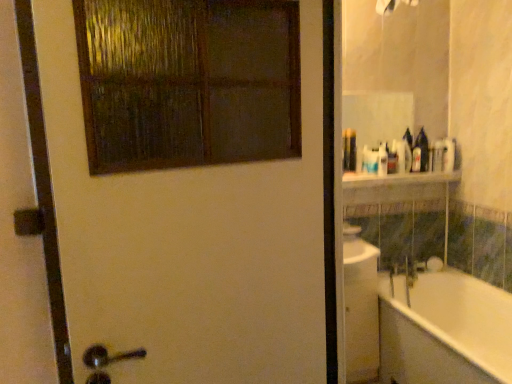
The image size is (512, 384). Identify the location of white glossy bathtub at right. (444, 330).

This screenshot has width=512, height=384. What do you see at coordinates (192, 241) in the screenshot? I see `white matte door at upper left` at bounding box center [192, 241].

Locate an element on the screen. white matte door at upper left is located at coordinates click(x=192, y=241).

The height and width of the screenshot is (384, 512). Describe the element at coordinates (392, 158) in the screenshot. I see `translucent plastic bottle at upper right` at that location.

Find the location of a particular element. This screenshot has width=512, height=384. white glossy bathtub at right is located at coordinates (444, 330).

Would you say white glossy shelf at upper center is to the left or to the right of translucent plastic bottle at upper right in the picture?

Based on their positions, white glossy shelf at upper center is located to the left of translucent plastic bottle at upper right.

In terms of height, does white glossy shelf at upper center look taller or shorter compared to translucent plastic bottle at upper right?

Clearly, white glossy shelf at upper center is shorter compared to translucent plastic bottle at upper right.

Does white glossy shelf at upper center have a lesser width compared to translucent plastic bottle at upper right?

No, white glossy shelf at upper center is not thinner than translucent plastic bottle at upper right.

From the image's perspective, is white glossy bathtub at right located beneath white matte door at upper left?

Indeed, from the image's perspective, white glossy bathtub at right is shown beneath white matte door at upper left.

Looking at the image, does white glossy bathtub at right seem bigger or smaller compared to white matte door at upper left?

In the image, white glossy bathtub at right appears to be larger than white matte door at upper left.

Between white glossy bathtub at right and white matte door at upper left, which one is positioned in front?

white matte door at upper left is in front.

Is translucent plastic bottle at upper right with white glossy bathtub at right?

They are not placed beside each other.

Between point (391, 154) and point (425, 363), which one is positioned in front?

The point (425, 363) is in front.

Is translucent plastic bottle at upper right looking in the opposite direction of white glossy bathtub at right?

No, translucent plastic bottle at upper right is not facing the opposite direction of white glossy bathtub at right.

From a real-world perspective, is translucent plastic bottle at upper right physically located above or below white glossy bathtub at right?

translucent plastic bottle at upper right is situated higher than white glossy bathtub at right in the real world.

Could you tell me if translucent plastic bottle at upper right is turned towards white matte door at upper left?

No, translucent plastic bottle at upper right does not turn towards white matte door at upper left.

Would you consider translucent plastic bottle at upper right to be distant from white matte door at upper left?

Yes, translucent plastic bottle at upper right and white matte door at upper left are quite far apart.

Is translucent plastic bottle at upper right taller or shorter than white matte door at upper left?

Clearly, translucent plastic bottle at upper right is shorter compared to white matte door at upper left.

From the image's perspective, between white matte door at upper left and white glossy bathtub at right, who is located below?

white glossy bathtub at right appears lower in the image.

Measure the distance between white matte door at upper left and white glossy bathtub at right.

6.20 feet.

Would you say white matte door at upper left is inside or outside white glossy bathtub at right?

white matte door at upper left is outside white glossy bathtub at right.

In the scene shown: Is white matte door at upper left further to camera compared to white glossy bathtub at right?

That is False.

Is white matte door at upper left facing away from white glossy shelf at upper center?

No, white matte door at upper left is not facing the opposite direction of white glossy shelf at upper center.

I want to click on door above the white glossy shelf at upper center (from a real-world perspective), so click(192, 241).

Can you confirm if white matte door at upper left is bigger than white glossy shelf at upper center?

Correct, white matte door at upper left is larger in size than white glossy shelf at upper center.

Between white matte door at upper left and white glossy shelf at upper center, which one has smaller width?

white matte door at upper left.

Based on the photo, is white matte door at upper left not close to translucent plastic bottle at upper right?

white matte door at upper left is far away from translucent plastic bottle at upper right.

In the scene shown: Does white matte door at upper left appear on the left side of translucent plastic bottle at upper right?

Yes, white matte door at upper left is to the left of translucent plastic bottle at upper right.

From a real-world perspective, relative to translucent plastic bottle at upper right, is white matte door at upper left vertically above or below?

In terms of real-world spatial position, white matte door at upper left is below translucent plastic bottle at upper right.

Could translucent plastic bottle at upper right be considered to be inside white matte door at upper left?

No, white matte door at upper left does not contain translucent plastic bottle at upper right.

The width and height of the screenshot is (512, 384). In order to click on toiletry lying behind the white glossy shelf at upper center in this screenshot , I will do `click(392, 158)`.

I want to click on bathtub that appears below the white matte door at upper left (from a real-world perspective), so click(x=444, y=330).

Estimate the real-world distances between objects in this image. Which object is further from white glossy shelf at upper center, white matte door at upper left or white glossy bathtub at right?

white matte door at upper left lies further to white glossy shelf at upper center than the other object.

Estimate the real-world distances between objects in this image. Which object is closer to white glossy bathtub at right, translucent plastic bottle at upper right or white matte door at upper left?

translucent plastic bottle at upper right.

From the image, which object appears to be nearer to translucent plastic bottle at upper right, white glossy shelf at upper center or white matte door at upper left?

Among the two, white glossy shelf at upper center is located nearer to translucent plastic bottle at upper right.

Based on their spatial positions, is white glossy shelf at upper center or translucent plastic bottle at upper right closer to white matte door at upper left?

The object closer to white matte door at upper left is white glossy shelf at upper center.

Considering their positions, is translucent plastic bottle at upper right positioned further to white matte door at upper left than white glossy shelf at upper center?

translucent plastic bottle at upper right lies further to white matte door at upper left than the other object.

Estimate the real-world distances between objects in this image. Which object is further from white glossy bathtub at right, white matte door at upper left or white glossy shelf at upper center?

white matte door at upper left.

Looking at the image, which one is located closer to translucent plastic bottle at upper right, white glossy bathtub at right or white glossy shelf at upper center?

Based on the image, white glossy shelf at upper center appears to be nearer to translucent plastic bottle at upper right.

When comparing their distances from translucent plastic bottle at upper right, does white matte door at upper left or white glossy shelf at upper center seem closer?

white glossy shelf at upper center is closer to translucent plastic bottle at upper right.

The image size is (512, 384). I want to click on balustrade between white matte door at upper left and translucent plastic bottle at upper right along the z-axis, so click(398, 179).

Identify the location of bathtub positioned between white matte door at upper left and white glossy shelf at upper center from near to far. The width and height of the screenshot is (512, 384). (444, 330).

Identify the location of bathtub between white matte door at upper left and translucent plastic bottle at upper right along the z-axis. The height and width of the screenshot is (384, 512). (444, 330).

Locate an element on the screen. This screenshot has width=512, height=384. balustrade between translucent plastic bottle at upper right and white glossy bathtub at right in the vertical direction is located at coordinates (398, 179).